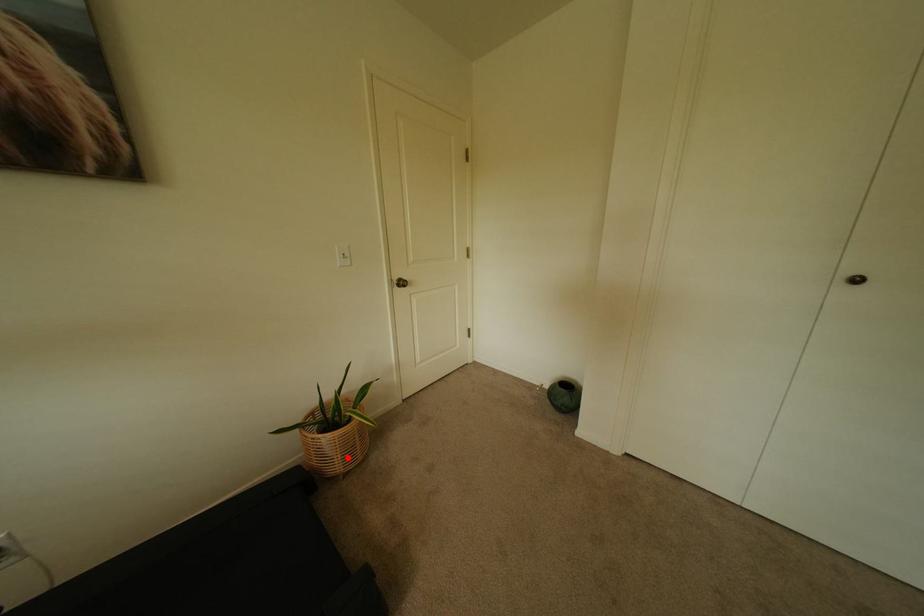
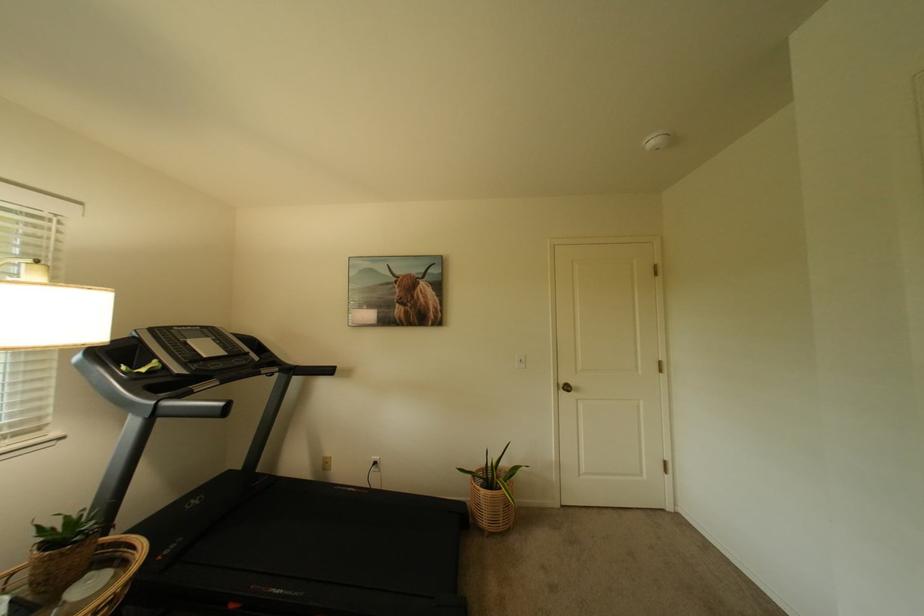
In the second image, find the point that corresponds to the highlighted location in the first image.

(495, 515)